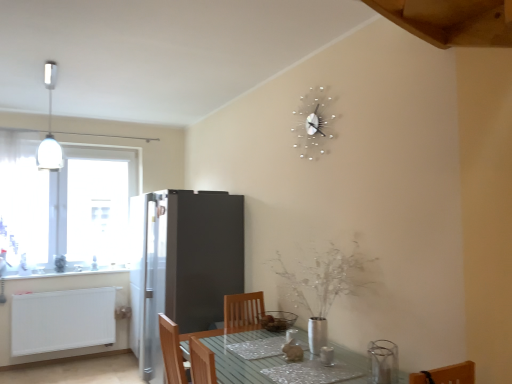
What do you see at coordinates (50, 127) in the screenshot?
I see `white glossy light fixture at upper left` at bounding box center [50, 127].

Describe the element at coordinates (65, 208) in the screenshot. I see `transparent glass window at left` at that location.

The image size is (512, 384). I want to click on wooden at upper right, so 452,20.

Describe the element at coordinates (62, 320) in the screenshot. I see `white matte radiator at lower left` at that location.

The height and width of the screenshot is (384, 512). What do you see at coordinates (313, 123) in the screenshot? I see `silver metallic clock at upper center` at bounding box center [313, 123].

Describe the element at coordinates (172, 350) in the screenshot. I see `wooden chair at lower center` at that location.

Where is `white glossy light fixture at upper left`? The width and height of the screenshot is (512, 384). white glossy light fixture at upper left is located at coordinates (50, 127).

How distant is wooden at upper right from white glossy counter top at left?

The distance of wooden at upper right from white glossy counter top at left is 4.05 meters.

How many degrees apart are the facing directions of wooden at upper right and white glossy counter top at left?

The angle between the facing direction of wooden at upper right and the facing direction of white glossy counter top at left is 25.7 degrees.

From the image's perspective, is wooden at upper right located beneath white glossy counter top at left?

No.

Locate an element on the screen. exhaust hood located above the white glossy counter top at left (from the image's perspective) is located at coordinates (452, 20).

Is silver metallic vase at center wider than white sheer curtain at left?

Yes.

Which is farther from the camera, (309, 269) or (32, 152)?

The point (32, 152) is farther.

Is silver metallic vase at center inside the boundaries of white sheer curtain at left, or outside?

silver metallic vase at center is not enclosed by white sheer curtain at left.

Is clear glass table at lower center with white sheer curtain at left?

There is a gap between clear glass table at lower center and white sheer curtain at left.

In the scene shown: From a real-world perspective, is clear glass table at lower center physically above white sheer curtain at left?

No.

From the image's perspective, is clear glass table at lower center below white sheer curtain at left?

Indeed, from the image's perspective, clear glass table at lower center is shown beneath white sheer curtain at left.

Does white glossy counter top at left have a lesser width compared to wooden chair at lower center?

Yes.

Considering the positions of points (41, 274) and (165, 322), is point (41, 274) farther from camera compared to point (165, 322)?

Yes, it is behind point (165, 322).

In order to click on chair in front of the white glossy counter top at left in this screenshot , I will do `click(172, 350)`.

Between white glossy counter top at left and wooden chair at lower center, which one is positioned in front?

Positioned in front is wooden chair at lower center.

Can you confirm if matte glass bowl at center is taller than white glossy light fixture at upper left?

Incorrect, the height of matte glass bowl at center is not larger of that of white glossy light fixture at upper left.

Consider the image. Relative to white glossy light fixture at upper left, is matte glass bowl at center in front or behind?

matte glass bowl at center is in front of white glossy light fixture at upper left.

Which point is more forward, (272, 326) or (58, 161)?

The point (58, 161) is closer.

How many degrees apart are the facing directions of satin silver refrigerator at center-left and matte glass bowl at center?

The facing directions of satin silver refrigerator at center-left and matte glass bowl at center are 0.338 degrees apart.

This screenshot has width=512, height=384. I want to click on fridge on the left of matte glass bowl at center, so [x=181, y=265].

Relative to matte glass bowl at center, is satin silver refrigerator at center-left in front or behind?

satin silver refrigerator at center-left is behind matte glass bowl at center.

Is silver metallic vase at center bigger than white glossy counter top at left?

Yes, silver metallic vase at center is bigger than white glossy counter top at left.

Does silver metallic vase at center turn towards white glossy counter top at left?

No, silver metallic vase at center is not facing towards white glossy counter top at left.

Would you say silver metallic vase at center is a long distance from white glossy counter top at left?

Yes, silver metallic vase at center and white glossy counter top at left are quite far apart.

From the picture: Does silver metallic vase at center have a lesser height compared to white glossy counter top at left?

Incorrect, the height of silver metallic vase at center does not fall short of that of white glossy counter top at left.

Find the location of a particular element. The width and height of the screenshot is (512, 384). exhaust hood above the white glossy counter top at left (from the image's perspective) is located at coordinates (452, 20).

Where is `flower in front of the white sheer curtain at left`? flower in front of the white sheer curtain at left is located at coordinates (322, 278).

When comparing their distances from wooden at upper right, does matte glass bowl at center or white glossy counter top at left seem further?

Based on the image, white glossy counter top at left appears to be further to wooden at upper right.

Which object lies nearer to the anchor point transparent glass window at left, silver metallic vase at center or white sheer curtain at left?

white sheer curtain at left lies closer to transparent glass window at left than the other object.

From the image, which object appears to be farther from matte glass bowl at center, clear glass table at lower center or wooden chair at lower center?

wooden chair at lower center.

Looking at the image, which one is located closer to satin silver refrigerator at center-left, wooden at upper right or transparent glass window at left?

The object closer to satin silver refrigerator at center-left is transparent glass window at left.

Considering their positions, is matte glass bowl at center positioned further to wooden at upper right than satin silver refrigerator at center-left?

Among the two, satin silver refrigerator at center-left is located further to wooden at upper right.

Based on the photo, considering their positions, is silver metallic vase at center positioned further to white matte radiator at lower left than matte glass bowl at center?

silver metallic vase at center lies further to white matte radiator at lower left than the other object.

When comparing their distances from clear glass table at lower center, does matte glass bowl at center or silver metallic vase at center seem further?

matte glass bowl at center is further to clear glass table at lower center.

Looking at this image, from the image, which object appears to be nearer to wooden at upper right, white sheer curtain at left or wooden chair at lower center?

wooden chair at lower center.

Locate an element on the screen. This screenshot has width=512, height=384. appliance between wooden chair at lower center and transparent glass window at left along the z-axis is located at coordinates (278, 321).

This screenshot has height=384, width=512. What are the coordinates of `fridge between white matte radiator at lower left and silver metallic clock at upper center from left to right` in the screenshot? It's located at (181, 265).

Identify the location of appliance between white glossy counter top at left and silver metallic clock at upper center. (278, 321).

Identify the location of fridge between white sheer curtain at left and wooden chair at lower center. The image size is (512, 384). 181,265.